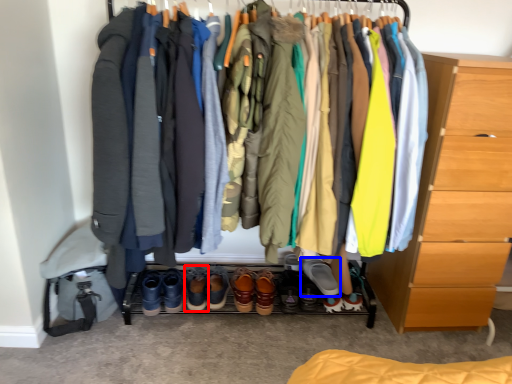
Question: Which object appears closest to the camera in this image, footwear (highlighted by a red box) or footwear (highlighted by a blue box)?

Choices:
 (A) footwear
 (B) footwear

Answer: (B)